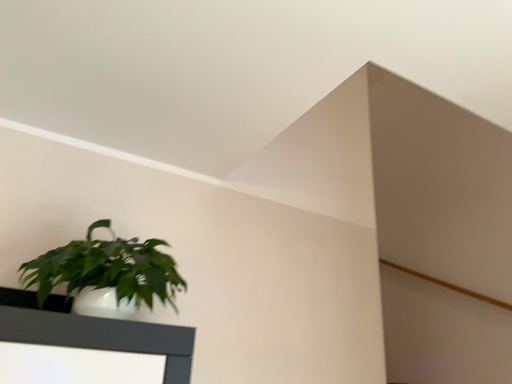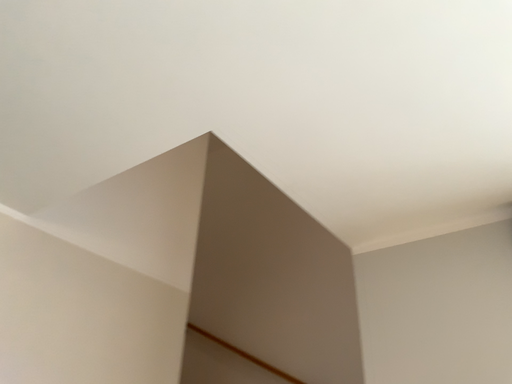
Question: How did the camera likely rotate when shooting the video?

Choices:
 (A) rotated left
 (B) rotated right

Answer: (B)